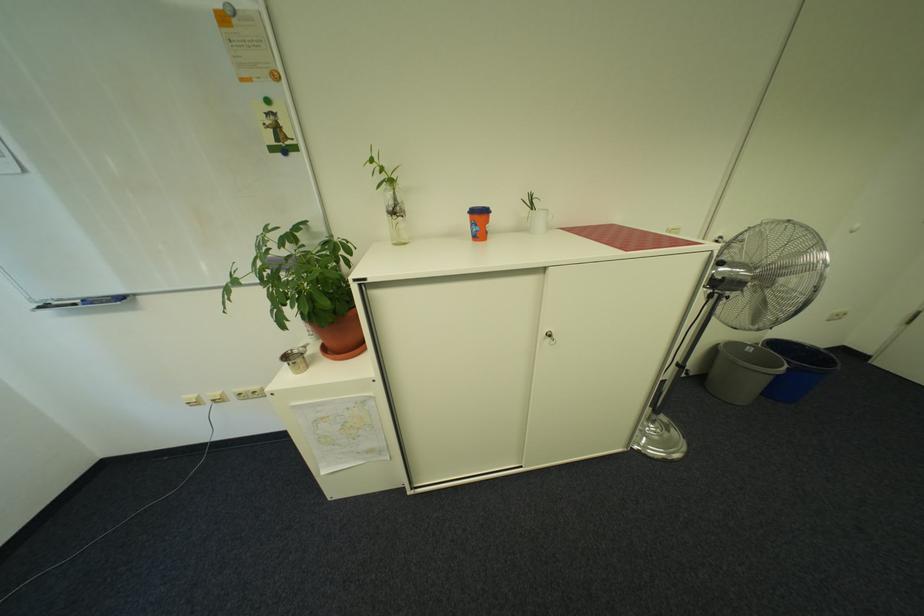
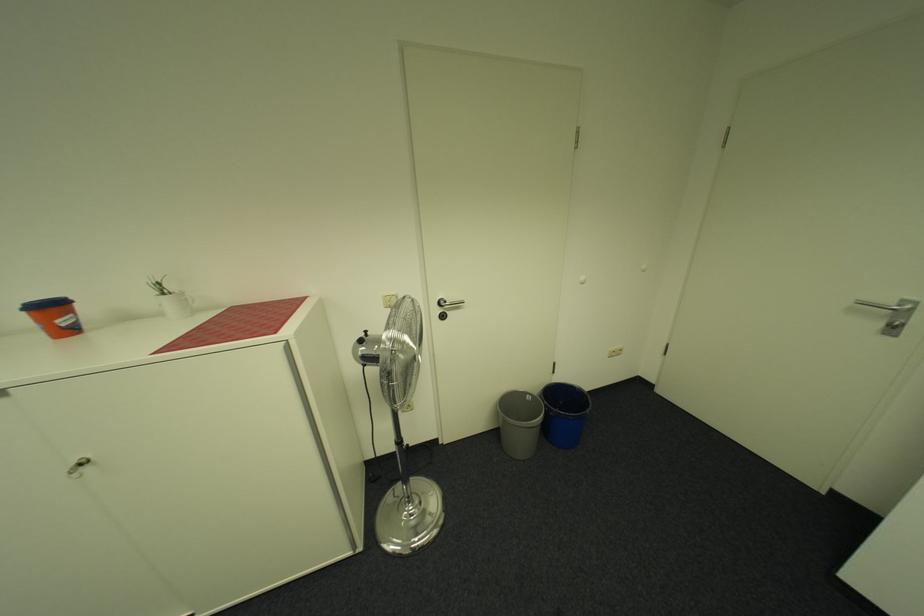
The point at (496, 231) is marked in the first image. Where is the corresponding point in the second image?

(73, 326)